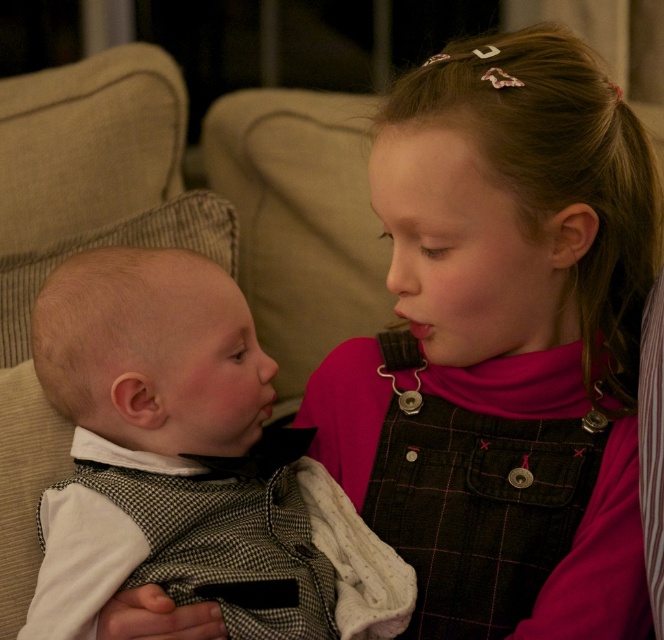
Question: Is pink cotton dress at center closer to the viewer compared to white cotton shirt at left?

Choices:
 (A) no
 (B) yes

Answer: (A)

Question: Is pink cotton dress at center above white cotton shirt at left?

Choices:
 (A) no
 (B) yes

Answer: (B)

Question: Which point is farther to the camera?

Choices:
 (A) (157, 346)
 (B) (384, 433)

Answer: (B)

Question: Among these objects, which one is nearest to the camera?

Choices:
 (A) white cotton shirt at left
 (B) pink cotton dress at center

Answer: (A)

Question: Which object is closer to the camera taking this photo?

Choices:
 (A) pink cotton dress at center
 (B) white cotton shirt at left

Answer: (B)

Question: Is pink cotton dress at center smaller than white cotton shirt at left?

Choices:
 (A) no
 (B) yes

Answer: (A)